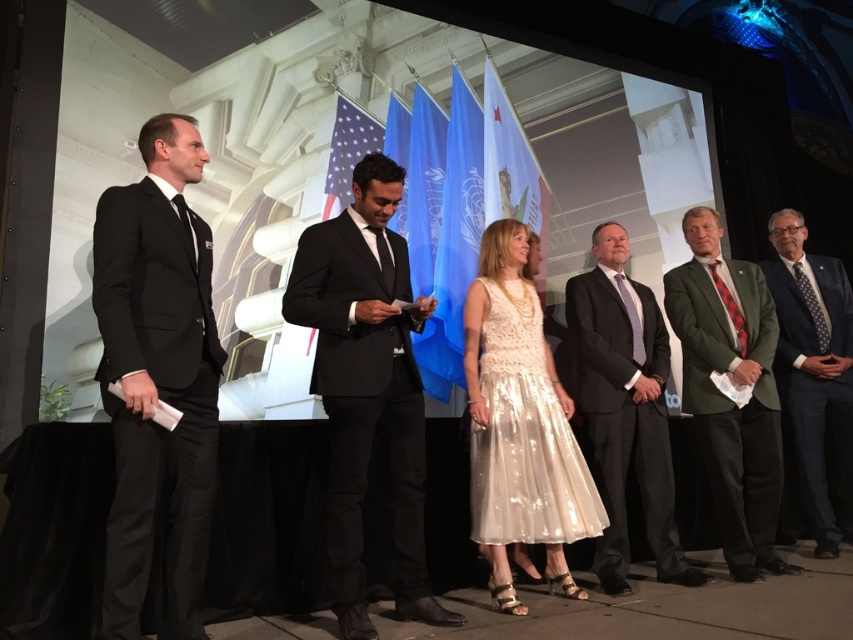
Between green wool suit at right and dark blue suit at right, which one is positioned lower?

A: green wool suit at right is lower down.

Describe the element at coordinates (727, 397) in the screenshot. I see `green wool suit at right` at that location.

Describe the element at coordinates (727, 397) in the screenshot. The height and width of the screenshot is (640, 853). I see `green wool suit at right` at that location.

Image resolution: width=853 pixels, height=640 pixels. I want to click on green wool suit at right, so click(727, 397).

Describe the element at coordinates (624, 408) in the screenshot. I see `dark gray suit at center` at that location.

Which is above, dark gray suit at center or dark blue suit at right?

dark blue suit at right is above.

Which is in front, point (656, 552) or point (805, 353)?

Point (656, 552) is in front.

This screenshot has height=640, width=853. In order to click on dark gray suit at center in this screenshot , I will do `click(624, 408)`.

What do you see at coordinates (519, 424) in the screenshot? I see `iridescent lace dress at center` at bounding box center [519, 424].

Find the location of a particular element. The width and height of the screenshot is (853, 640). iridescent lace dress at center is located at coordinates (519, 424).